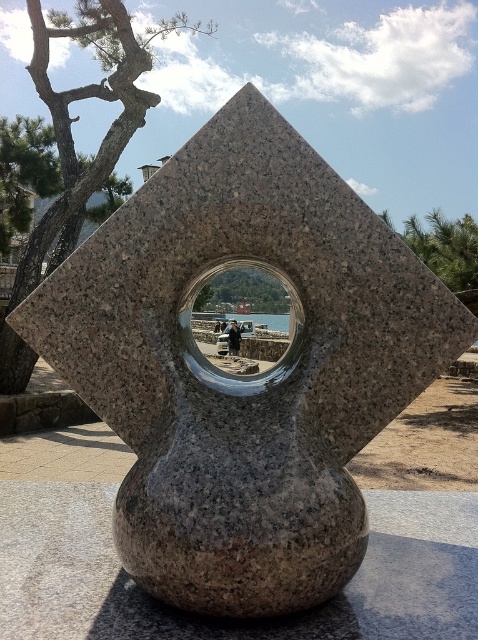
Does green leafy tree at center appear on the left side of dark blue jeans at center?

Correct, you'll find green leafy tree at center to the left of dark blue jeans at center.

Between green leafy tree at center and dark blue jeans at center, which one is positioned higher?

Positioned higher is green leafy tree at center.

Find the location of a particular element. The width and height of the screenshot is (478, 640). green leafy tree at center is located at coordinates (242, 292).

Identify the location of green leafy tree at center. (242, 292).

Which is below, green leafy tree at center or transparent glass water at center?

transparent glass water at center

Is point (207, 292) farther from viewer compared to point (216, 316)?

No, it is in front of (216, 316).

I want to click on green leafy tree at center, so click(242, 292).

Does transparent glass hole at center appear on the left side of green textured tree at upper right?

Indeed, transparent glass hole at center is positioned on the left side of green textured tree at upper right.

Does transparent glass hole at center appear over green textured tree at upper right?

No, transparent glass hole at center is not above green textured tree at upper right.

Between point (203, 269) and point (467, 243), which one is positioned in front?

Positioned in front is point (203, 269).

Identify the location of transparent glass hole at center. Image resolution: width=478 pixels, height=640 pixels. (207, 360).